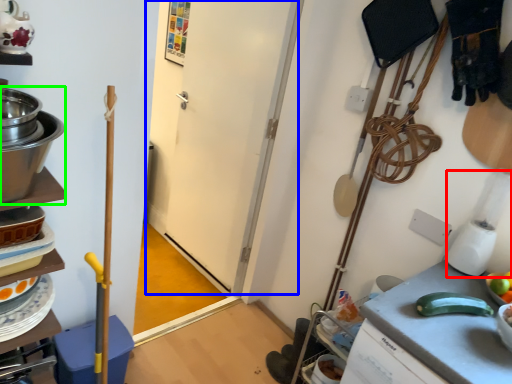
Question: Which object is the closest to the blender (highlighted by a red box)? Choose among these: door (highlighted by a blue box) or appliance (highlighted by a green box).

Choices:
 (A) door
 (B) appliance

Answer: (A)